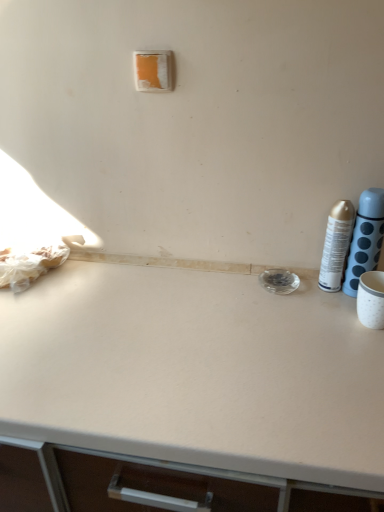
Question: Relative to silver metallic can at right, which appears as the first bottle when viewed from the left, is orange matte/light switch at upper center in front or behind?

Choices:
 (A) behind
 (B) front

Answer: (A)

Question: From the image's perspective, is orange matte/light switch at upper center positioned above or below silver metallic can at right, placed as the 2th bottle when sorted from right to left?

Choices:
 (A) above
 (B) below

Answer: (A)

Question: Estimate the real-world distances between objects in this image. Which object is farther from the silver metallic can at right, which appears as the first bottle when viewed from the left?

Choices:
 (A) metallic silver spray can at right, positioned as the first bottle in right-to-left order
 (B) orange matte/light switch at upper center

Answer: (B)

Question: Which is nearer to the silver metallic can at right, placed as the 2th bottle when sorted from right to left?

Choices:
 (A) metallic silver spray can at right, acting as the 2th bottle starting from the left
 (B) orange matte/light switch at upper center

Answer: (A)